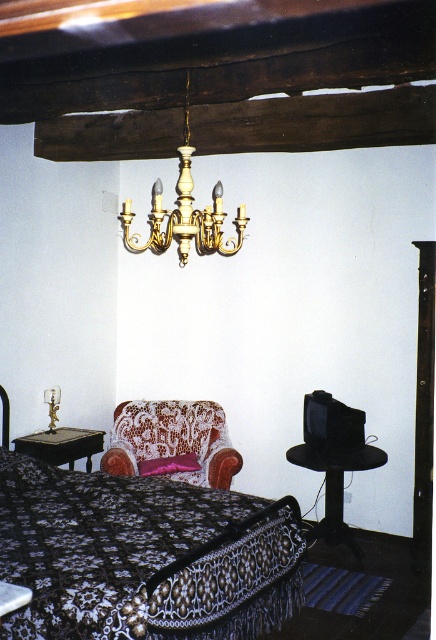
Question: Is gold polished chandelier at upper center above pink satin pillow at center?

Choices:
 (A) no
 (B) yes

Answer: (B)

Question: Is black lace bed at center thinner than velvet floral armchair at lower center?

Choices:
 (A) no
 (B) yes

Answer: (A)

Question: Can you confirm if velvet floral armchair at lower center is thinner than gold polished chandelier at upper center?

Choices:
 (A) no
 (B) yes

Answer: (A)

Question: Which object is positioned closest to the gold polished chandelier at upper center?

Choices:
 (A) pink satin pillow at center
 (B) velvet floral armchair at lower center
 (C) black lace bed at center

Answer: (C)

Question: Which of the following is the closest to the observer?

Choices:
 (A) black lace bed at center
 (B) pink satin pillow at center

Answer: (A)

Question: Which object is positioned farthest from the velvet floral armchair at lower center?

Choices:
 (A) gold polished chandelier at upper center
 (B) pink satin pillow at center
 (C) black lace bed at center

Answer: (A)